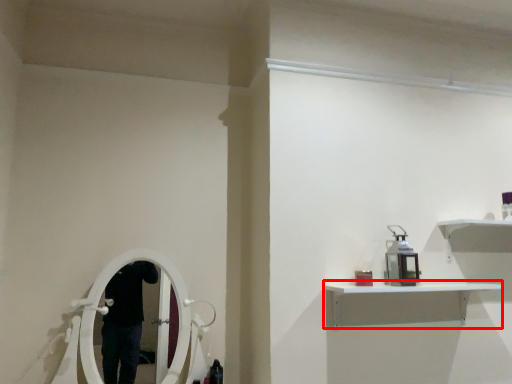
Question: From the image's perspective, where is shelf (annotated by the red box) located in relation to equipment in the image?

Choices:
 (A) below
 (B) above

Answer: (A)